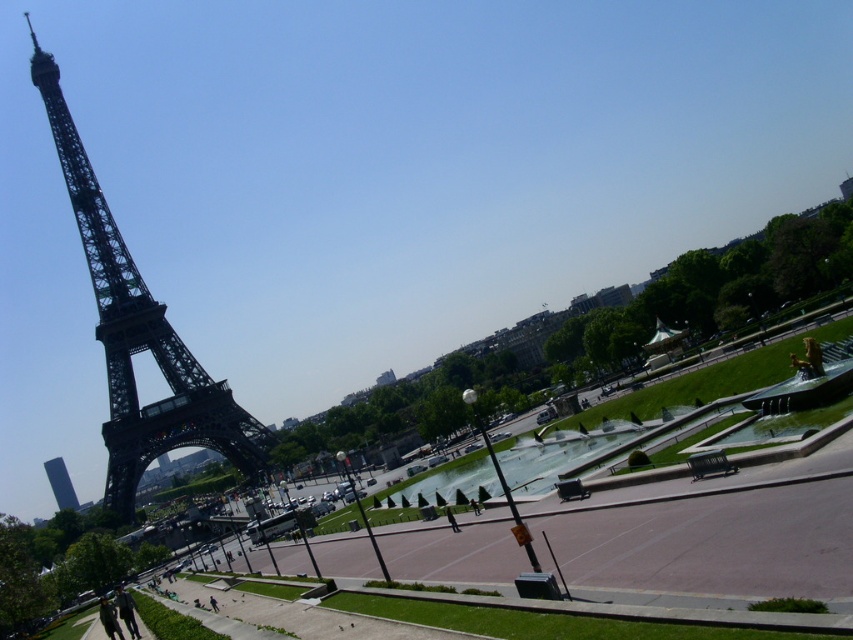
Question: Does black metal eiffel tower at left appear on the right side of dark blue jeans at lower left?

Choices:
 (A) yes
 (B) no

Answer: (B)

Question: Which of the following is the farthest from the observer?

Choices:
 (A) (64, 502)
 (B) (115, 307)

Answer: (A)

Question: Which object is positioned farthest from the black metal eiffel tower at left?

Choices:
 (A) dark blue jeans at lower left
 (B) smooth glass tower at left

Answer: (B)

Question: From the image, what is the correct spatial relationship of black metal eiffel tower at left in relation to smooth glass tower at left?

Choices:
 (A) left
 (B) right

Answer: (B)

Question: In this image, where is black metal eiffel tower at left located relative to dark blue jeans at lower left?

Choices:
 (A) below
 (B) above

Answer: (B)

Question: Which object is closer to the camera taking this photo?

Choices:
 (A) smooth glass tower at left
 (B) dark blue jeans at lower left
 (C) black metal eiffel tower at left

Answer: (C)